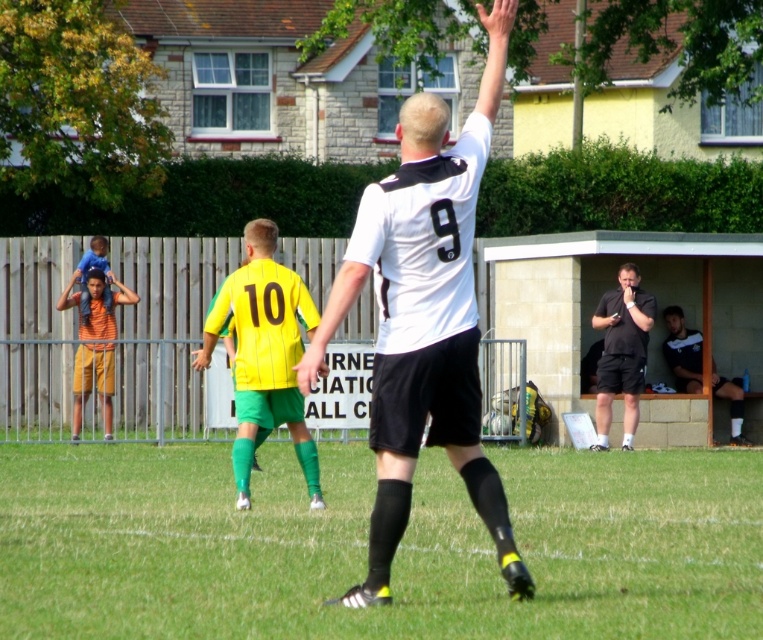
You are a soccer player standing on the field. You notice the green grass at center and the white matte jersey at center. Which one is closer to the ground?

The green grass at center is shorter than the white matte jersey at center, so the green grass at center is closer to the ground.

You are a soccer player standing at the center circle. You need to pass the ball to the green grass at center. Which direction should you kick the ball?

The green grass at center is located at point coordinates, so you should kick the ball towards the center of the field where the green grass is situated.